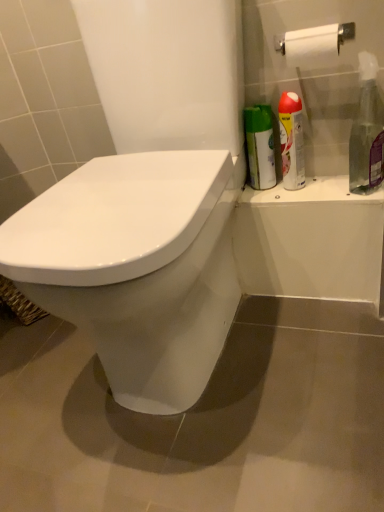
The height and width of the screenshot is (512, 384). Find the location of `vacant area that is situated to the right of silver metallic spray can at upper right, the 2th cleaning product in the right-to-left sequence`. vacant area that is situated to the right of silver metallic spray can at upper right, the 2th cleaning product in the right-to-left sequence is located at coordinates (337, 177).